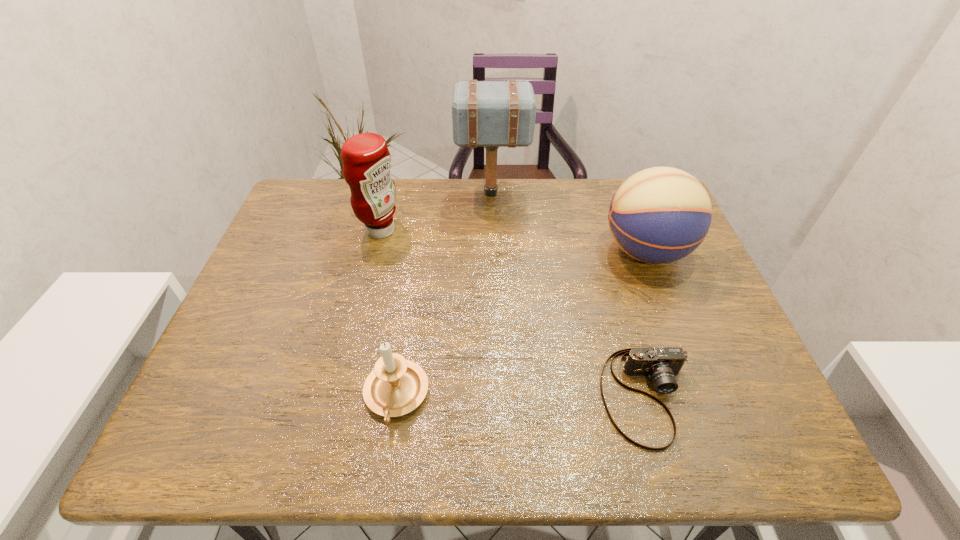
I want to click on vacant space located 0.360m on the patterned surface of the basketball, so click(x=468, y=251).

Identify the location of vacant space situated 0.180m on the patterned surface of the basketball. This screenshot has width=960, height=540. click(535, 251).

This screenshot has width=960, height=540. I want to click on vacant region located 0.400m on the patterned surface of the basketball, so click(x=454, y=251).

At what (x,y) coordinates should I click in order to perform the action: click on mallet positioned at the far edge. Please return your answer as a coordinate pair (x, y). The image size is (960, 540). Looking at the image, I should click on (491, 114).

This screenshot has height=540, width=960. What are the coordinates of `condiment that is at the far edge` in the screenshot? It's located at (366, 159).

Identify the location of basketball present at the far edge. Image resolution: width=960 pixels, height=540 pixels. (659, 215).

Identify the location of candle holder situated at the near edge. (396, 386).

At what (x,y) coordinates should I click in order to perform the action: click on camera that is at the near edge. Please return your answer as a coordinate pair (x, y). Looking at the image, I should click on (661, 365).

Locate an element on the screen. basketball that is at the right edge is located at coordinates (659, 215).

The image size is (960, 540). I want to click on camera positioned at the right edge, so [x=661, y=365].